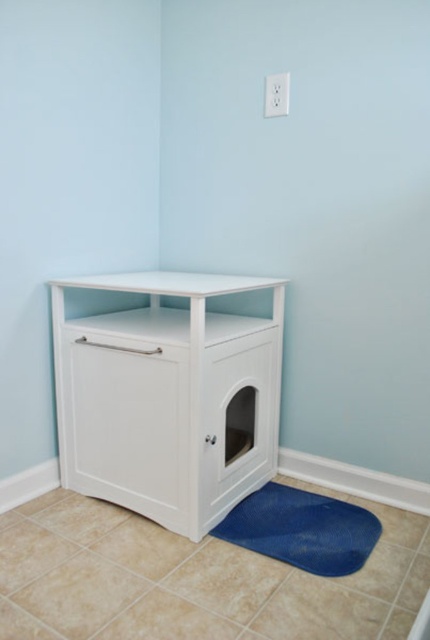
Does white matte cabinet at lower left appear on the left side of blue textured mat at lower center?

Indeed, white matte cabinet at lower left is positioned on the left side of blue textured mat at lower center.

Can you confirm if white matte cabinet at lower left is shorter than blue textured mat at lower center?

No.

Is point (184, 362) in front of point (279, 509)?

Yes, point (184, 362) is in front of point (279, 509).

Locate an element on the screen. white matte cabinet at lower left is located at coordinates (165, 396).